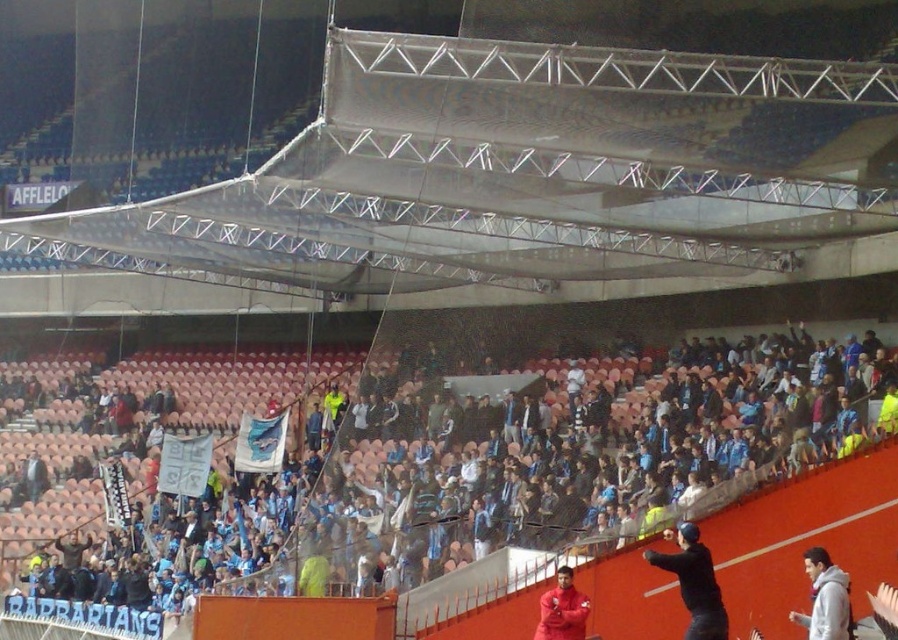
You are a drone operator trying to capture aerial footage of the stadium. Your drone is currently at the point marked by coordinates point (487, 483). What is the most prominent object or group directly beneath this point?

The point (487, 483) marks the blue fabric crowd at center, so the most prominent object directly beneath this point is the blue fabric crowd at center.

You are a drone operator trying to capture aerial footage of the stadium. The blue fabric crowd at center and the black matte jacket at lower right are in your camera frame. Based on their heights, which object would block the view of the other if they are aligned along the same line of sight?

The blue fabric crowd at center has a greater height compared to the black matte jacket at lower right, so it would block the view of the black matte jacket at lower right if they are aligned along the same line of sight.

You are standing at the camera position and want to throw a ball to someone in the blue fabric crowd at center. If the maximum throwing distance you can achieve is 50 meters, will you be able to reach them?

The distance between you and the blue fabric crowd at center is 55.81 meters, which exceeds your maximum throwing distance of 50 meters. Therefore, you will not be able to reach them.